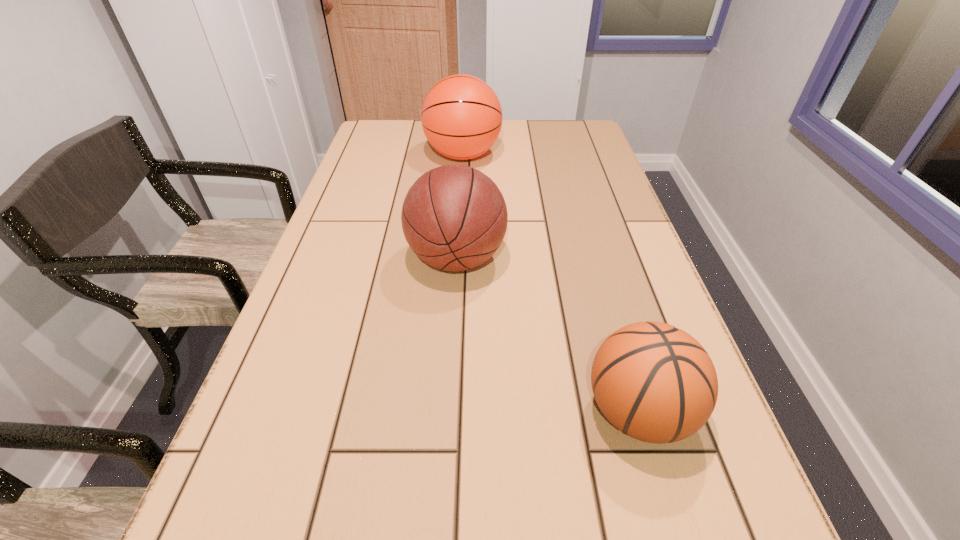
Identify the location of vacant area at the left edge of the desktop. point(323,287).

This screenshot has width=960, height=540. Identify the location of vacant space at the right edge of the desktop. (582, 192).

Where is `vacant space that is in between the second nearest basketball and the nearest basketball`? vacant space that is in between the second nearest basketball and the nearest basketball is located at coordinates (547, 335).

You are a GUI agent. You are given a task and a screenshot of the screen. Output one action in this format:
    pyautogui.click(x=<x>, y=<y>)
    Task: Click on the vacant area between the rightmost basketball and the farthest basketball
    Image resolution: width=960 pixels, height=540 pixels.
    Given the screenshot: What is the action you would take?
    (x=551, y=283)

Identify the location of object that is the closest one to the shortest object. This screenshot has height=540, width=960. (454, 217).

Locate which object ranks in proximity to the second nearest basketball. Please provide its 2D coordinates. Your answer should be formatted as a tuple, i.e. [(x, y)], where the tuple contains the x and y coordinates of a point satisfying the conditions above.

[(656, 383)]

Choose which basketball is the nearest neighbor to the farthest basketball. Please provide its 2D coordinates. Your answer should be formatted as a tuple, i.e. [(x, y)], where the tuple contains the x and y coordinates of a point satisfying the conditions above.

[(454, 217)]

In order to click on the second closest basketball to the nearest basketball in this screenshot , I will do `click(461, 116)`.